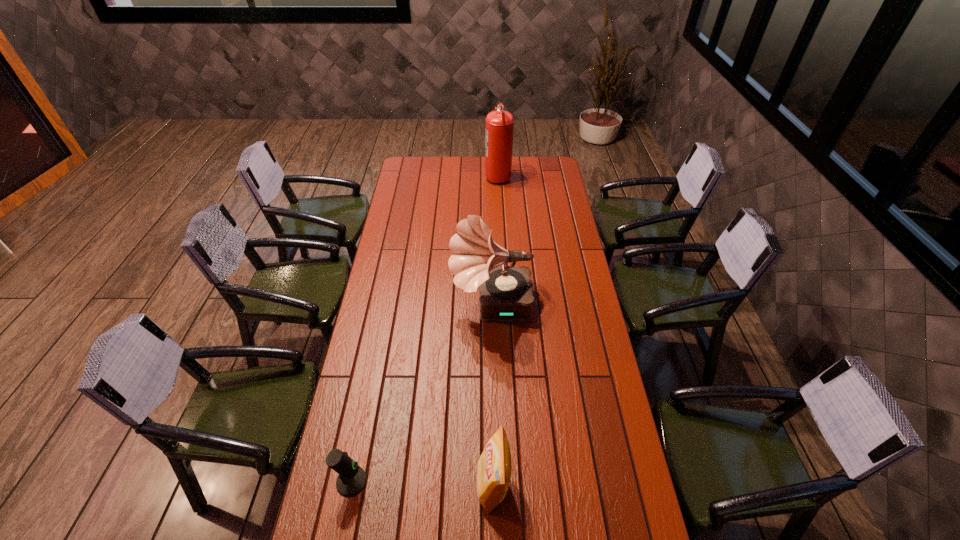
This screenshot has width=960, height=540. Identify the location of unoccupied position between the shortest object and the record player. (421, 393).

This screenshot has width=960, height=540. What are the coordinates of `empty location between the record player and the microphone` in the screenshot? It's located at (421, 393).

This screenshot has width=960, height=540. What are the coordinates of `vacant space that is in between the fire extinguisher and the shortest object` in the screenshot? It's located at (424, 328).

Identify the location of vacant point located between the shortest object and the third nearest object. (421, 393).

Find the location of `empty space between the second shortest object and the leftmost object`. empty space between the second shortest object and the leftmost object is located at coordinates (422, 483).

What are the coordinates of `object that ranks as the closest to the leftmost object` in the screenshot? It's located at (494, 465).

Image resolution: width=960 pixels, height=540 pixels. Identify the location of object that is the third closest to the second farthest object. (499, 128).

What are the coordinates of `vacant space that satisfies the following two spatial constraints: 1. on the instruction side of the farthest object; 2. on the front side of the microphone` in the screenshot? It's located at (514, 481).